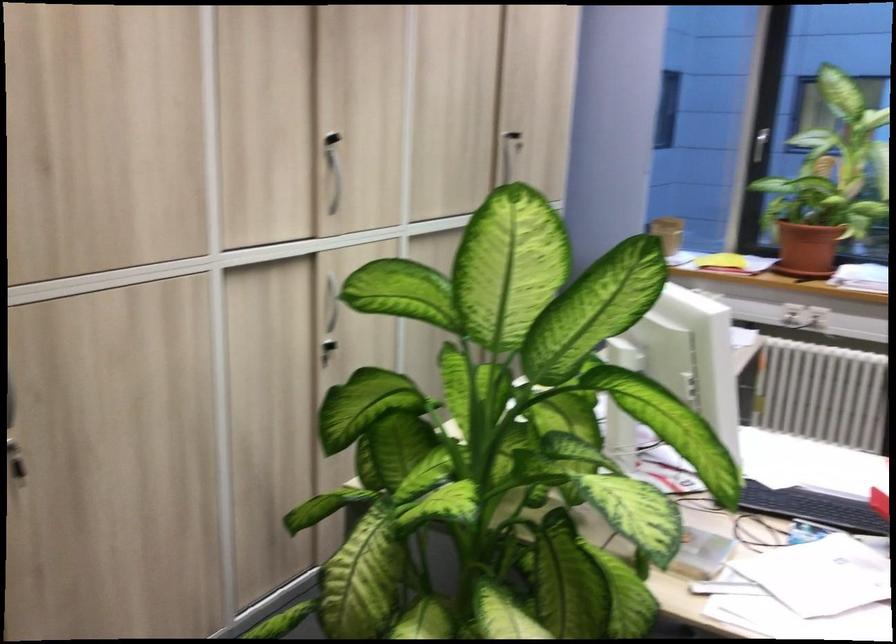
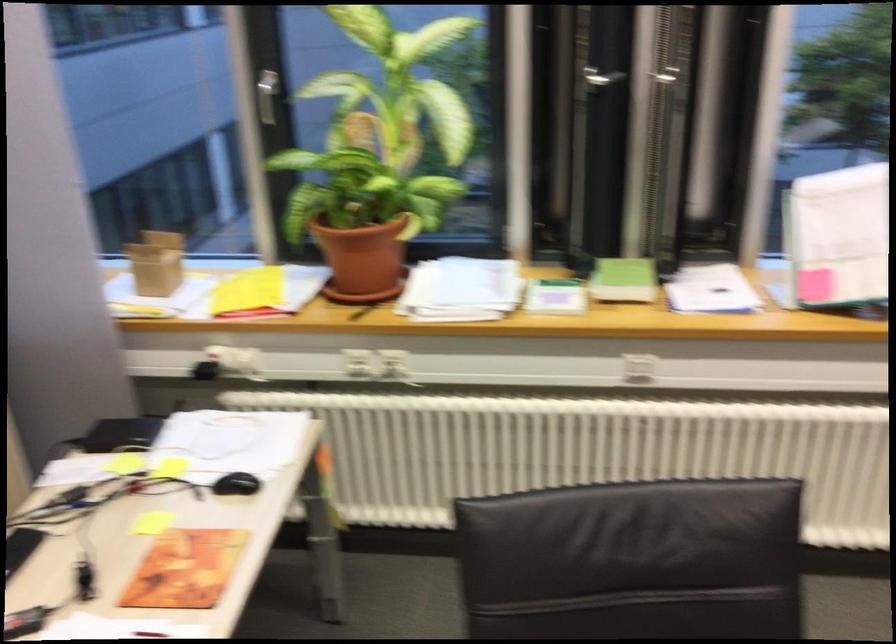
Find the pixel in the second image that matches point 798,249 in the first image.

(363, 257)